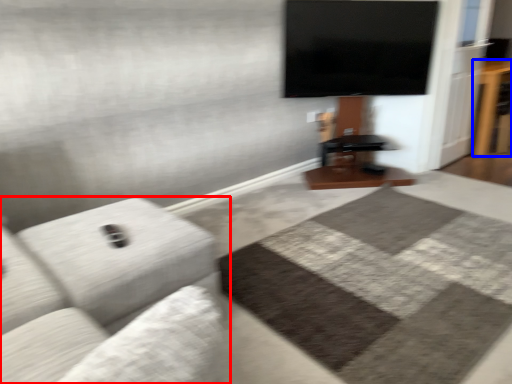
Question: Which point is further to the camera, studio couch (highlighted by a red box) or table (highlighted by a blue box)?

Choices:
 (A) studio couch
 (B) table

Answer: (B)